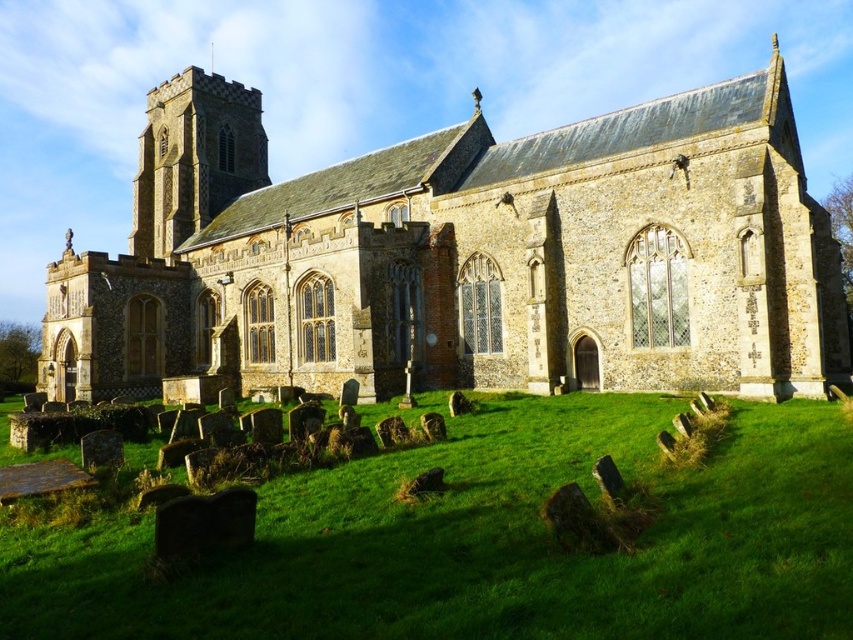
Does brown stone church at center appear under green grass at lower center?

Incorrect, brown stone church at center is not positioned below green grass at lower center.

Is the position of brown stone church at center less distant than that of green grass at lower center?

No, brown stone church at center is further to the viewer.

Is point (573, 316) positioned behind point (764, 589)?

Yes, it is behind point (764, 589).

Where is `brown stone church at center`? brown stone church at center is located at coordinates (x=462, y=257).